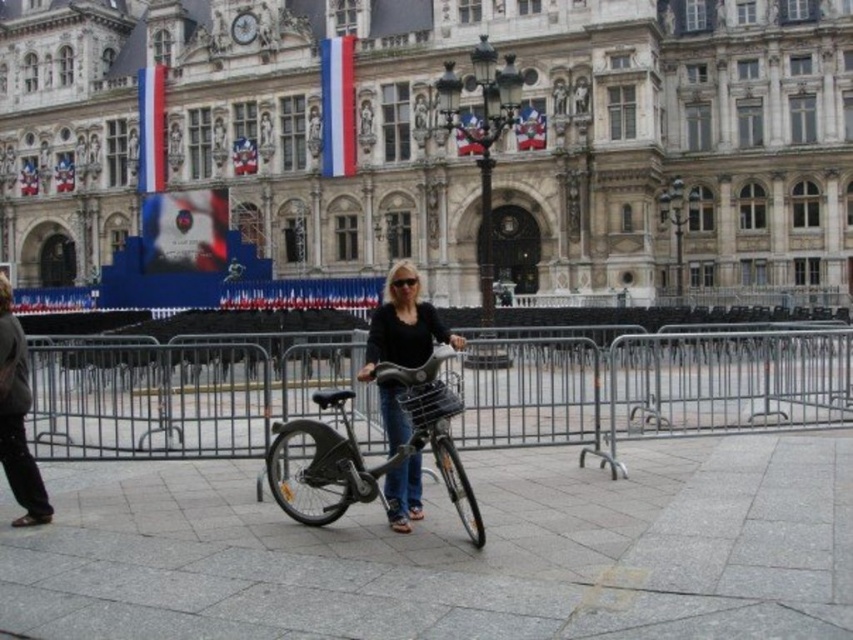
Which is below, gray stone pavement at center or dark gray pants at left?

Positioned lower is gray stone pavement at center.

Where is `gray stone pavement at center`? This screenshot has height=640, width=853. gray stone pavement at center is located at coordinates (456, 552).

At what (x,y) coordinates should I click in order to perform the action: click on gray stone pavement at center. Please return your answer as a coordinate pair (x, y). The width and height of the screenshot is (853, 640). Looking at the image, I should click on (456, 552).

Does point (289, 499) come behind point (16, 460)?

Yes.

Where is `metallic silver bicycle at center`? The image size is (853, 640). metallic silver bicycle at center is located at coordinates (360, 452).

Can you confirm if metallic silver bicycle at center is positioned below matte black bicycle at center?

Correct, metallic silver bicycle at center is located below matte black bicycle at center.

Who is lower down, metallic silver bicycle at center or matte black bicycle at center?

Positioned lower is metallic silver bicycle at center.

Does point (392, 378) lie in front of point (402, 412)?

Yes, point (392, 378) is closer to viewer.

Find the location of a particular element. metallic silver bicycle at center is located at coordinates (x=360, y=452).